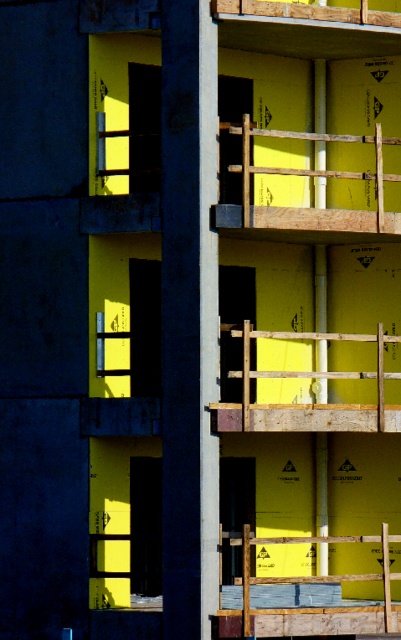
What are the coordinates of the yellow foam insulation at center?

The coordinates of the yellow foam insulation at center are at point (309,608).

You are an inspector checking the construction site. You notice two wooden structures, the wooden frame at center and the wooden at upper center. Which one has a greater width?

The wooden frame at center has a greater width than the wooden at upper center.